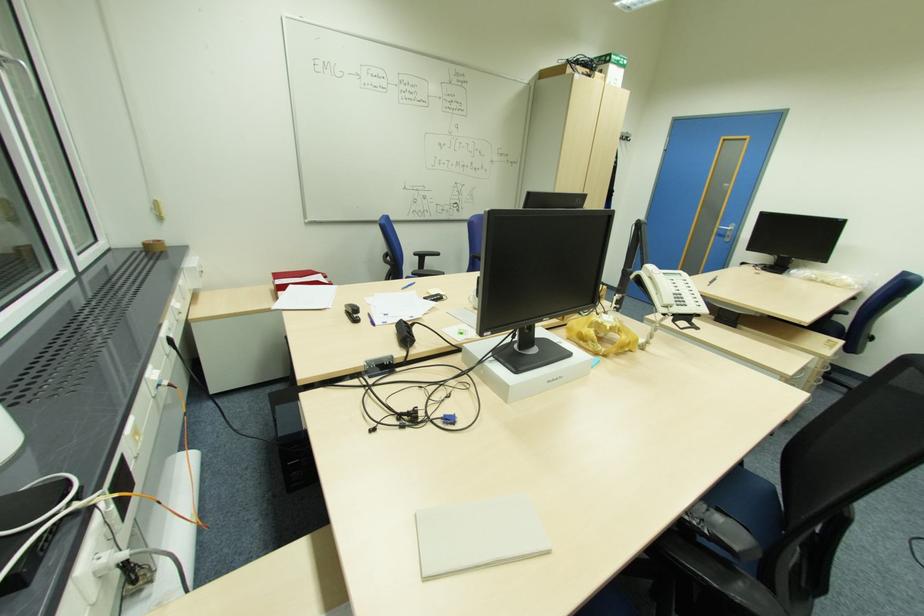
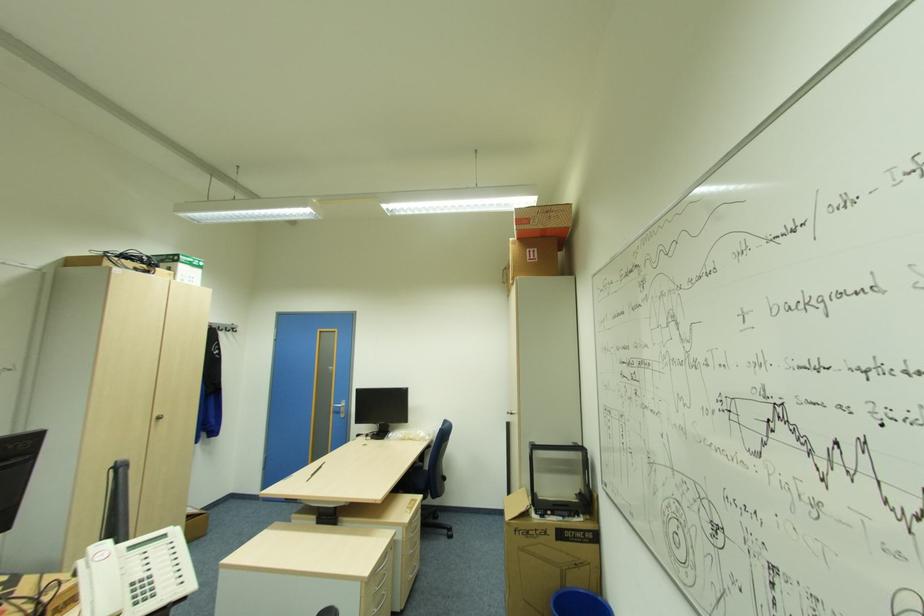
Based on the continuous images, in which direction is the camera rotating?

The rotation direction of the camera is right-up.